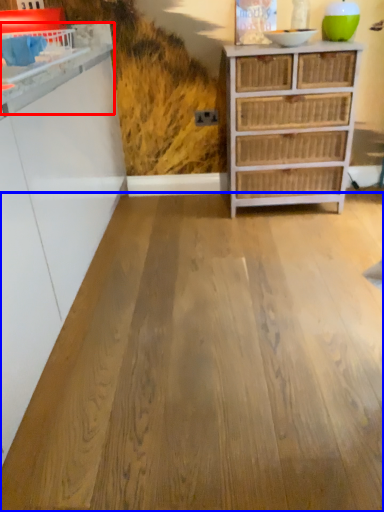
Question: Which object is closer to the camera taking this photo, counter (highlighted by a red box) or plywood (highlighted by a blue box)?

Choices:
 (A) counter
 (B) plywood

Answer: (B)